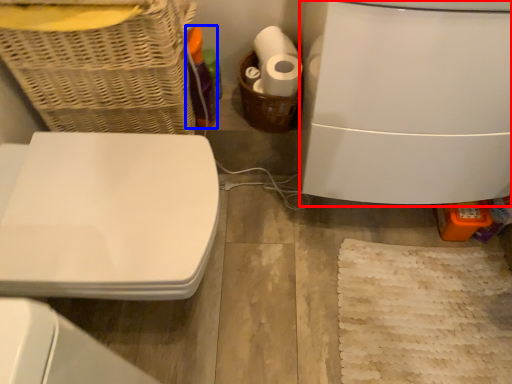
Question: Which point is closer to the camera, appliance (highlighted by a red box) or bottle (highlighted by a blue box)?

Choices:
 (A) appliance
 (B) bottle

Answer: (A)